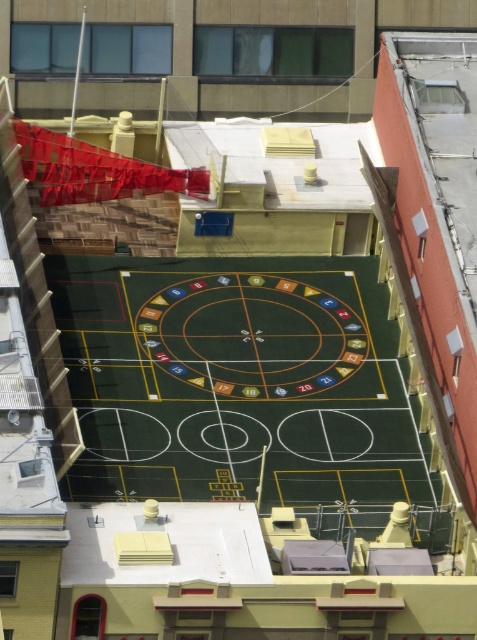
You are a maintenance worker inspecting the rooftop. You notice the green rubber basketball court at center and the green felt roulette at center. Which object is positioned lower in the aerial view?

The green rubber basketball court at center is positioned lower than the green felt roulette at center in the aerial view.

You are a drone operator trying to land a drone on the rooftop basketball court. The drone has GPS coordinates that must align with specific points on the court. According to the image, where is the point marked as point (244,387) located?

The point marked as point (244,387) is located at the center of the green rubber basketball court.

In the scene shown: You are standing on the rooftop basketball court and want to throw a ball from point (221, 412) to point (235, 292). Considering the court layout described, will the ball travel towards the beige building or the red brick building?

The ball will travel towards the beige building because point (221, 412) is closer to the viewer than point (235, 292), indicating the beige building is in that direction.